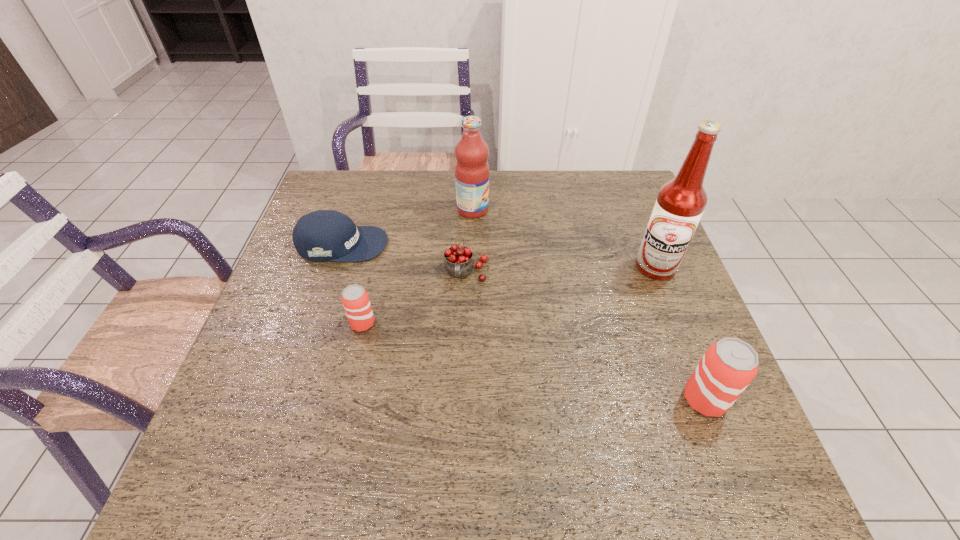
Where is `object that is positioned at the near right corner`? This screenshot has height=540, width=960. object that is positioned at the near right corner is located at coordinates (728, 366).

The height and width of the screenshot is (540, 960). What are the coordinates of `free space at the far edge of the desktop` in the screenshot? It's located at (498, 204).

You are a GUI agent. You are given a task and a screenshot of the screen. Output one action in this format:
    pyautogui.click(x=<x>, y=<y>)
    Task: Click on the free region at the near edge of the desktop
    The height and width of the screenshot is (540, 960).
    Given the screenshot: What is the action you would take?
    pyautogui.click(x=551, y=399)

This screenshot has width=960, height=540. In the image, there is a desktop. Find the location of `free space at the left edge`. free space at the left edge is located at coordinates (304, 336).

This screenshot has width=960, height=540. In the image, there is a desktop. What are the coordinates of `free space at the right edge` in the screenshot? It's located at (703, 329).

The height and width of the screenshot is (540, 960). In the image, there is a desktop. What are the coordinates of `free space at the near left corner` in the screenshot? It's located at (273, 424).

In the image, there is a desktop. What are the coordinates of `vacant space at the far right corner` in the screenshot? It's located at click(587, 177).

This screenshot has height=540, width=960. I want to click on vacant region at the near right corner of the desktop, so click(x=704, y=422).

This screenshot has height=540, width=960. What are the coordinates of `free area in between the baseball cap and the cherry` in the screenshot? It's located at (404, 259).

Find the location of a particular element. The image size is (960, 540). empty location between the baseball cap and the farthest object is located at coordinates (407, 227).